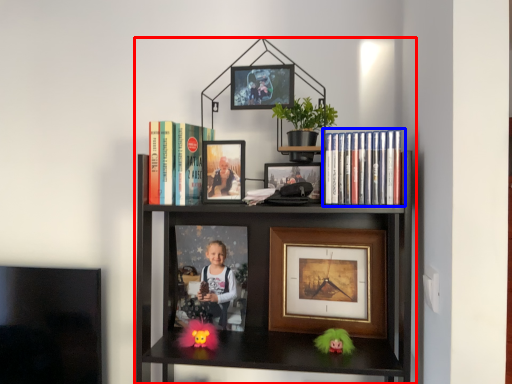
Question: Which of the following is the closest to the observer, bookcase (highlighted by a red box) or book (highlighted by a blue box)?

Choices:
 (A) bookcase
 (B) book

Answer: (A)